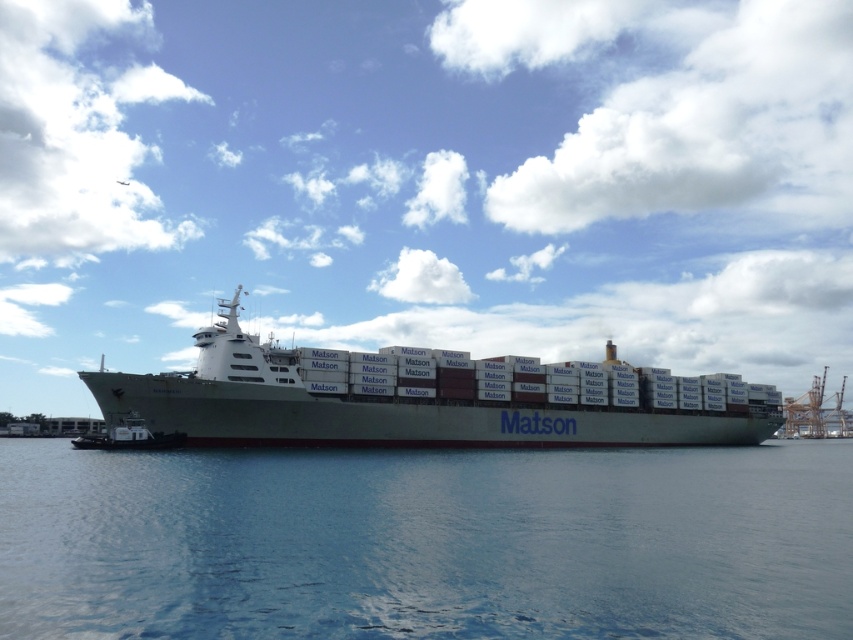
Question: Is blue water at center smaller than white matte container ship at center?

Choices:
 (A) yes
 (B) no

Answer: (A)

Question: Which point is farther to the camera?

Choices:
 (A) (653, 451)
 (B) (212, 388)

Answer: (A)

Question: Can you confirm if blue water at center is thinner than white matte container ship at center?

Choices:
 (A) yes
 (B) no

Answer: (B)

Question: Is blue water at center smaller than white matte container ship at center?

Choices:
 (A) yes
 (B) no

Answer: (A)

Question: Among these objects, which one is farthest from the camera?

Choices:
 (A) blue water at center
 (B) white matte container ship at center

Answer: (B)